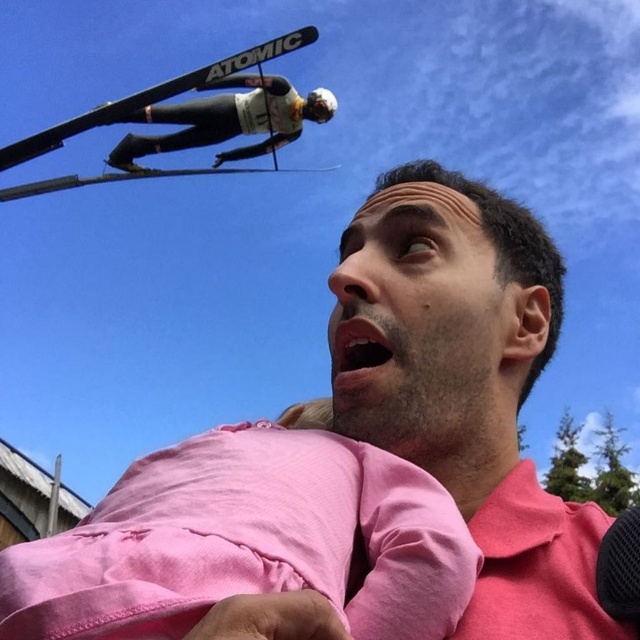
Can you confirm if pink cotton shirt at center is thinner than black matte ski suit at upper left?

Yes.

Is pink cotton shirt at center bigger than black matte ski suit at upper left?

Incorrect, pink cotton shirt at center is not larger than black matte ski suit at upper left.

Where is `pink cotton shirt at center`? pink cotton shirt at center is located at coordinates (465, 385).

Where is `pink cotton shirt at center`? pink cotton shirt at center is located at coordinates (465, 385).